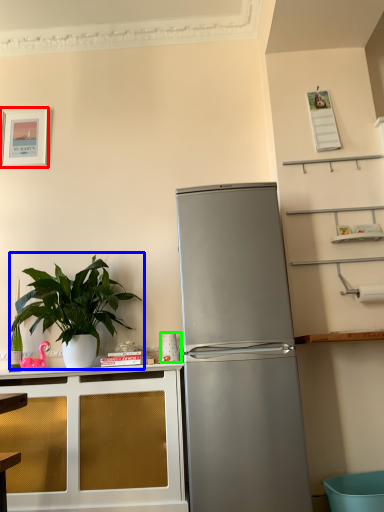
Question: Estimate the real-world distances between objects in this image. Which object is closer to picture frame (highlighted by a red box), houseplant (highlighted by a blue box) or appliance (highlighted by a green box)?

Choices:
 (A) houseplant
 (B) appliance

Answer: (A)